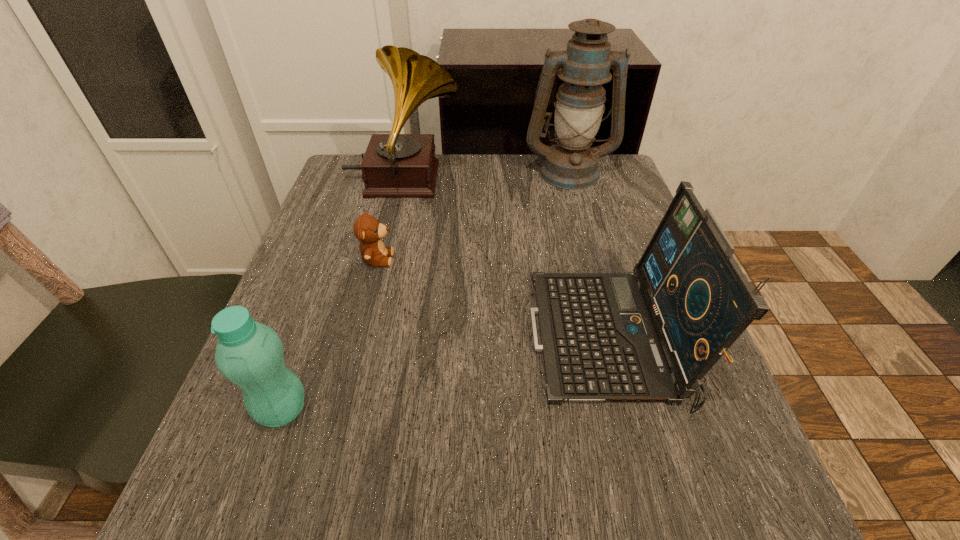
Find the location of a particular element. The width and height of the screenshot is (960, 540). free space between the oil lamp and the bottle is located at coordinates (425, 291).

Locate an element on the screen. Image resolution: width=960 pixels, height=540 pixels. vacant area that lies between the shortest object and the oil lamp is located at coordinates (473, 215).

The height and width of the screenshot is (540, 960). Find the location of `unoccupied area between the oil lamp and the laptop computer`. unoccupied area between the oil lamp and the laptop computer is located at coordinates (588, 255).

The height and width of the screenshot is (540, 960). What are the coordinates of `free space between the oil lamp and the bottle` in the screenshot? It's located at [x=425, y=291].

Locate an element on the screen. This screenshot has height=540, width=960. free space between the laptop computer and the shortest object is located at coordinates (492, 299).

Locate an element on the screen. The image size is (960, 540). unoccupied position between the bottle and the phonograph record is located at coordinates (343, 295).

Image resolution: width=960 pixels, height=540 pixels. Find the location of `free area in between the bottle and the shortest object`. free area in between the bottle and the shortest object is located at coordinates (330, 334).

You are a GUI agent. You are given a task and a screenshot of the screen. Output one action in this format:
    pyautogui.click(x=<x>, y=<y>)
    Task: Click on the object that is the fourth closest to the phonograph record
    
    Given the screenshot: What is the action you would take?
    pyautogui.click(x=249, y=354)

I want to click on object that can be found as the closest to the third farthest object, so click(394, 165).

Where is `blank area in the image that satisfies the following two spatial constraints: 1. on the front side of the oil lamp; 2. from the horn of the phonograph record`? The height and width of the screenshot is (540, 960). blank area in the image that satisfies the following two spatial constraints: 1. on the front side of the oil lamp; 2. from the horn of the phonograph record is located at coordinates point(571,181).